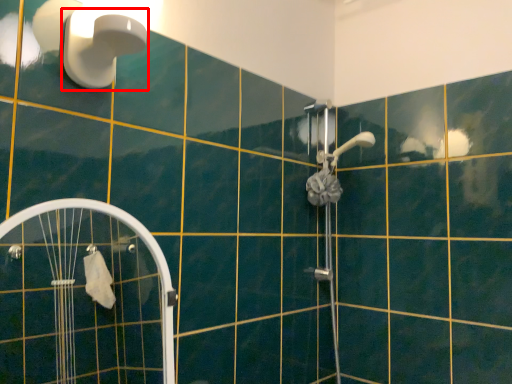
Question: From the image's perspective, what is the correct spatial relationship of shower (annotated by the red box) in relation to screen door?

Choices:
 (A) above
 (B) below

Answer: (A)